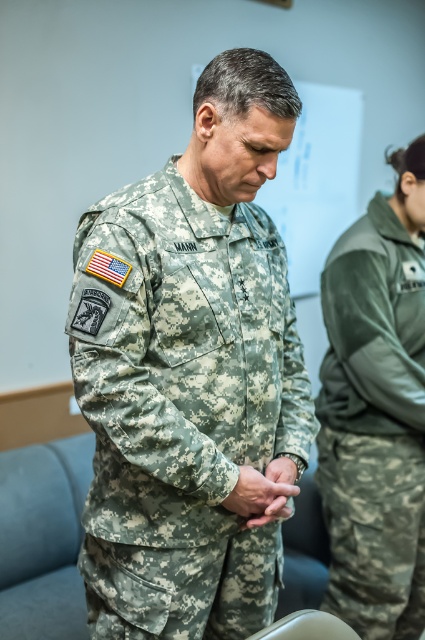
You are a photographer in the room and want to take a picture of the green matte uniform at right and the camouflage fabric hand at center. Which object should be placed closer to the camera to ensure both are in focus?

The green matte uniform at right is much taller than the camouflage fabric hand at center. To ensure both are in focus, place the green matte uniform at right closer to the camera since it is larger and requires more focus depth.

You are a tailor who needs to compare the sizes of two uniforms. You have the camouflage fabric uniform at center and the green matte uniform at right. Which uniform requires more fabric to make?

The camouflage fabric uniform at center requires more fabric because it is larger in size than the green matte uniform at right.

You are an observer in the meeting room. You see a green matte uniform at right and a camouflage fabric hand at center. Which object is wider?

The green matte uniform at right is wider than the camouflage fabric hand at center.